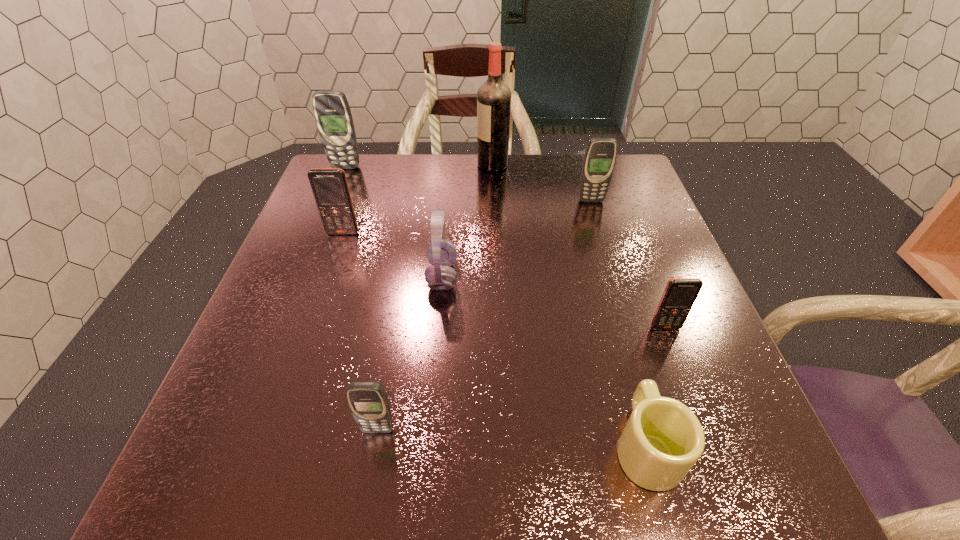
Where is `the fourth farthest cellular telephone`? This screenshot has width=960, height=540. the fourth farthest cellular telephone is located at coordinates (679, 295).

Where is `the third nearest object`? This screenshot has width=960, height=540. the third nearest object is located at coordinates (679, 295).

At what (x,y) coordinates should I click in order to perform the action: click on the smallest gray cellular telephone. Please return your answer as a coordinate pair (x, y). This screenshot has width=960, height=540. Looking at the image, I should click on (368, 401).

This screenshot has height=540, width=960. In order to click on the nearest cellular telephone in this screenshot , I will do `click(368, 401)`.

At what (x,y) coordinates should I click in order to perform the action: click on beige mug. Please return your answer as a coordinate pair (x, y). Looking at the image, I should click on (662, 440).

Where is `the shortest object`? The height and width of the screenshot is (540, 960). the shortest object is located at coordinates (662, 440).

This screenshot has width=960, height=540. In order to click on vacant space located on the front-facing side of the liquor in this screenshot , I will do `click(349, 165)`.

Where is `vacant space located on the front-facing side of the liquor`? vacant space located on the front-facing side of the liquor is located at coordinates (423, 165).

Locate an element on the screen. The width and height of the screenshot is (960, 540). vacant region located on the front-facing side of the liquor is located at coordinates tap(434, 165).

Where is `vacant space located 0.390m on the screen of the biggest gray cellular telephone`? Image resolution: width=960 pixels, height=540 pixels. vacant space located 0.390m on the screen of the biggest gray cellular telephone is located at coordinates tap(308, 260).